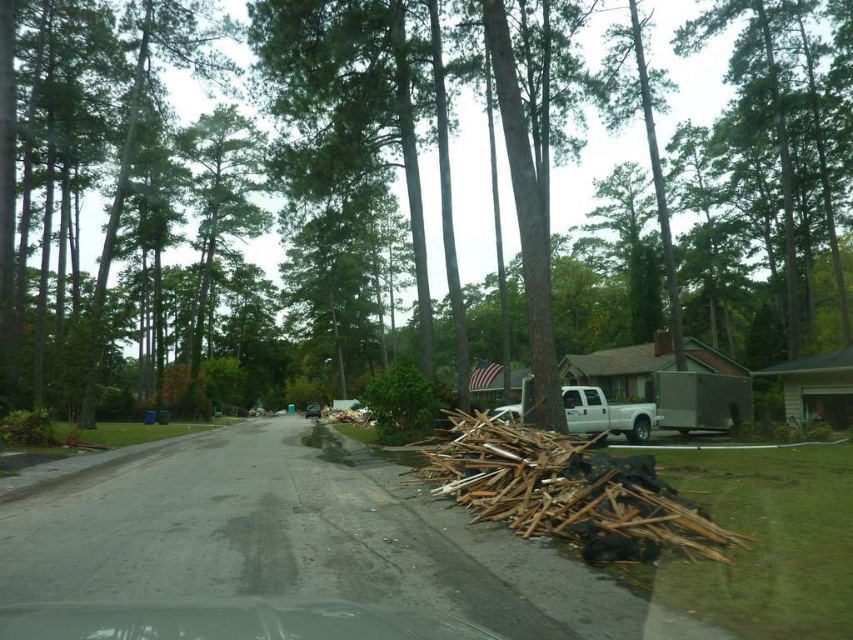
You are a delivery driver who needs to park your vehicle between the brown wood tree at center and the brown wood debris at lower right. Can you fit your truck there if your truck is 2 meters wide?

The brown wood tree at center is positioned on the right side of brown wood debris at lower right, but the distance between them isn not specified in the objects description. Without knowing the exact space between them, it is impossible to determine if the truck can fit.